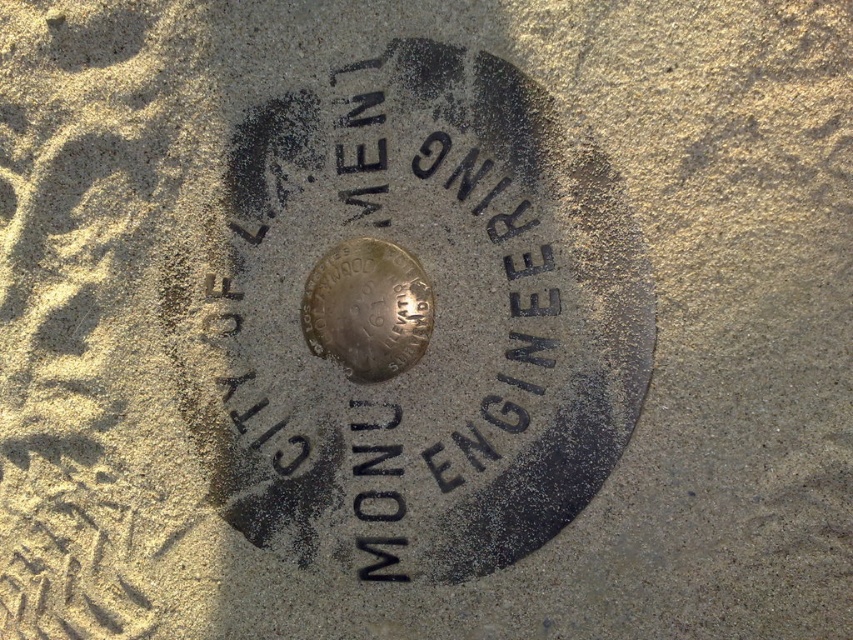
Does black metal marker at center have a greater height compared to shiny metallic coin at center?

Indeed, black metal marker at center has a greater height compared to shiny metallic coin at center.

Identify the location of black metal marker at center. Image resolution: width=853 pixels, height=640 pixels. tap(433, 314).

Who is more forward, (309,106) or (422,330)?

Point (422,330) is in front.

Find the location of `black metal marker at center`. black metal marker at center is located at coordinates (433, 314).